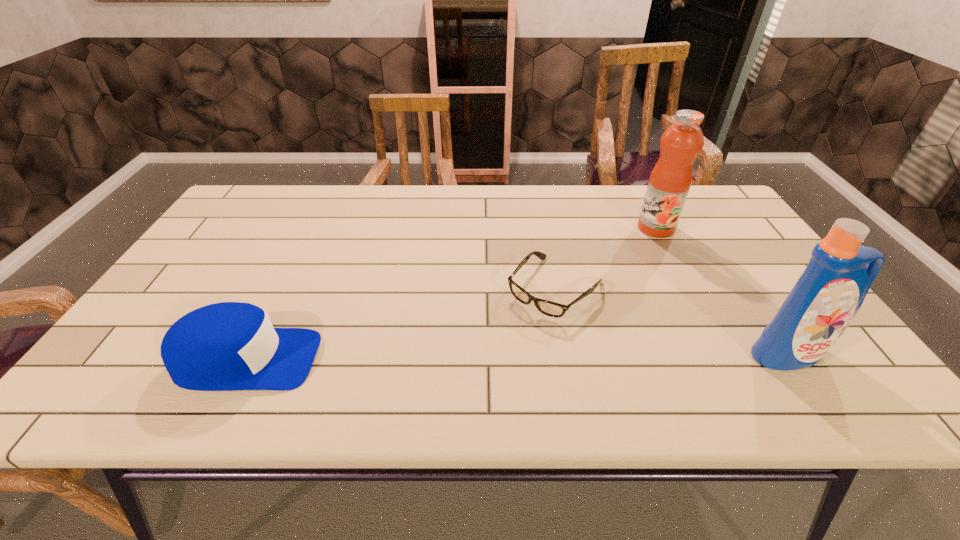
At what (x,y) coordinates should I click in order to perform the action: click on the second shortest object. Please return your answer as a coordinate pair (x, y). This screenshot has width=960, height=540. Looking at the image, I should click on (226, 346).

Find the location of a particular element. baseball cap is located at coordinates (226, 346).

I want to click on detergent, so click(827, 296).

I want to click on fruit juice, so click(671, 178).

Identify the location of the farthest object. (671, 178).

Identify the location of the shortest object. Image resolution: width=960 pixels, height=540 pixels. (549, 308).

Find the location of a particular element. The image size is (960, 540). the third object from right to left is located at coordinates (549, 308).

At what (x,y) coordinates should I click in order to perform the action: click on vacant space located 0.360m on the front-facing side of the leftmost object. Please return your answer as a coordinate pair (x, y). Image resolution: width=960 pixels, height=540 pixels. Looking at the image, I should click on (485, 360).

Identify the location of free point located 0.050m on the front label of the fruit juice. (641, 245).

This screenshot has height=540, width=960. Find the location of `vacant region located on the front label of the fruit juice`. vacant region located on the front label of the fruit juice is located at coordinates (600, 291).